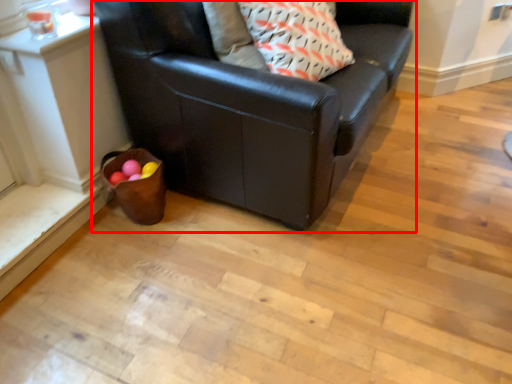
Question: Observing the image, what is the correct spatial positioning of studio couch (annotated by the red box) in reference to throw pillow?

Choices:
 (A) left
 (B) right

Answer: (A)